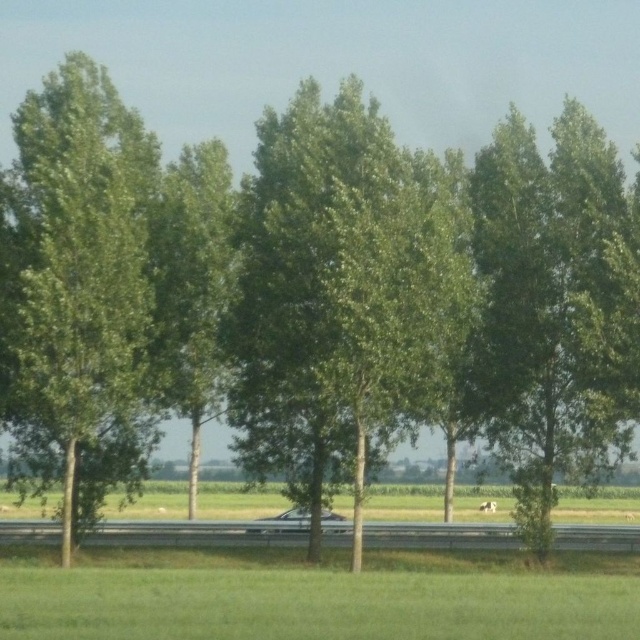
You are standing at the center of the image and want to locate the green leafy tree at center. What are the coordinates of this tree?

The green leafy tree at center is located at coordinates point (339, 296).